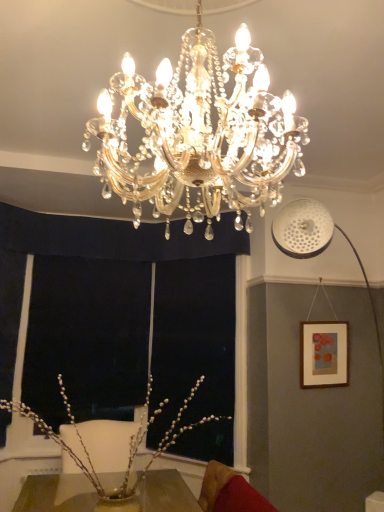
Measure the distance between velvet red swivel chair at lower right and camera.

velvet red swivel chair at lower right and camera are 7.40 feet apart from each other.

Where is `pearl-like branches at center`? pearl-like branches at center is located at coordinates (130, 444).

Find the location of a particular element. Image resolution: width=384 pixels, height=512 pixels. wooden picture frame at right is located at coordinates (323, 354).

Consider the image. Can you confirm if gold crystal chandelier at center is smaller than velvet red swivel chair at lower right?

No, gold crystal chandelier at center is not smaller than velvet red swivel chair at lower right.

Based on the photo, how much distance is there between gold crystal chandelier at center and velvet red swivel chair at lower right?

gold crystal chandelier at center and velvet red swivel chair at lower right are 1.90 meters apart.

From the image's perspective, does gold crystal chandelier at center appear higher than velvet red swivel chair at lower right?

Yes, from the image's perspective, gold crystal chandelier at center is on top of velvet red swivel chair at lower right.

From the picture: Are gold crystal chandelier at center and velvet red swivel chair at lower right located far from each other?

Yes, gold crystal chandelier at center and velvet red swivel chair at lower right are quite far apart.

In the scene shown: Which of these two, velvet red swivel chair at lower right or pearl-like branches at center, is smaller?

Smaller between the two is velvet red swivel chair at lower right.

Which object is closer to the camera taking this photo, velvet red swivel chair at lower right or pearl-like branches at center?

pearl-like branches at center is in front.

I want to click on floral arrangement above the velvet red swivel chair at lower right (from the image's perspective), so click(130, 444).

What's the angular difference between velvet red swivel chair at lower right and pearl-like branches at center's facing directions?

89 degrees separate the facing orientations of velvet red swivel chair at lower right and pearl-like branches at center.

Considering the relative positions of velvet red swivel chair at lower right and gold crystal chandelier at center in the image provided, is velvet red swivel chair at lower right behind gold crystal chandelier at center?

Yes.

Locate an element on the screen. This screenshot has width=384, height=512. lamp above the velvet red swivel chair at lower right (from a real-world perspective) is located at coordinates (199, 133).

Which object is thinner, velvet red swivel chair at lower right or gold crystal chandelier at center?

With smaller width is velvet red swivel chair at lower right.

Is point (302, 376) closer to viewer compared to point (249, 231)?

Yes, point (302, 376) is closer to viewer.

From the image's perspective, which is below, wooden picture frame at right or gold crystal chandelier at center?

wooden picture frame at right is shown below in the image.

Does wooden picture frame at right have a lesser width compared to gold crystal chandelier at center?

Correct, the width of wooden picture frame at right is less than that of gold crystal chandelier at center.

Is wooden picture frame at right not close to gold crystal chandelier at center?

Yes, wooden picture frame at right is far from gold crystal chandelier at center.

How many degrees apart are the facing directions of gold crystal chandelier at center and wooden picture frame at right?

90 degrees.

Looking at this image, from a real-world perspective, relative to wooden picture frame at right, is gold crystal chandelier at center vertically above or below?

Clearly, from a real-world perspective, gold crystal chandelier at center is above wooden picture frame at right.

Is gold crystal chandelier at center looking in the opposite direction of wooden picture frame at right?

That's not correct — gold crystal chandelier at center is not looking away from wooden picture frame at right.

From the image's perspective, is gold crystal chandelier at center beneath wooden picture frame at right?

No, from the image's perspective, gold crystal chandelier at center is not below wooden picture frame at right.

At what (x,y) coordinates should I click in order to perform the action: click on floral arrangement located underneath the gold crystal chandelier at center (from a real-world perspective). Please return your answer as a coordinate pair (x, y). Looking at the image, I should click on (130, 444).

From a real-world perspective, is gold crystal chandelier at center on top of pearl-like branches at center?

Yes, from a real-world perspective, gold crystal chandelier at center is over pearl-like branches at center

Considering the sizes of objects gold crystal chandelier at center and pearl-like branches at center in the image provided, who is smaller, gold crystal chandelier at center or pearl-like branches at center?

Smaller between the two is pearl-like branches at center.

From the picture: In terms of width, does pearl-like branches at center look wider or thinner when compared to wooden picture frame at right?

In the image, pearl-like branches at center appears to be wider than wooden picture frame at right.

Who is taller, pearl-like branches at center or wooden picture frame at right?

pearl-like branches at center is taller.

Can wooden picture frame at right be found inside pearl-like branches at center?

Definitely not — wooden picture frame at right is not inside pearl-like branches at center.

The width and height of the screenshot is (384, 512). In order to click on lamp on the left of velvet red swivel chair at lower right in this screenshot , I will do `click(199, 133)`.

This screenshot has width=384, height=512. Find the location of `floral arrangement above the velvet red swivel chair at lower right (from a real-world perspective)`. floral arrangement above the velvet red swivel chair at lower right (from a real-world perspective) is located at coordinates (130, 444).

Looking at the image, which one is located closer to velvet red swivel chair at lower right, gold crystal chandelier at center or wooden picture frame at right?

wooden picture frame at right is positioned closer to the anchor velvet red swivel chair at lower right.

When comparing their distances from gold crystal chandelier at center, does pearl-like branches at center or wooden picture frame at right seem further?

pearl-like branches at center is positioned further to the anchor gold crystal chandelier at center.

Which object lies nearer to the anchor point wooden picture frame at right, gold crystal chandelier at center or pearl-like branches at center?

The object closer to wooden picture frame at right is pearl-like branches at center.

Based on their spatial positions, is velvet red swivel chair at lower right or pearl-like branches at center closer to wooden picture frame at right?

Based on the image, pearl-like branches at center appears to be nearer to wooden picture frame at right.

Estimate the real-world distances between objects in this image. Which object is further from velvet red swivel chair at lower right, wooden picture frame at right or pearl-like branches at center?

Among the two, wooden picture frame at right is located further to velvet red swivel chair at lower right.

Based on their spatial positions, is pearl-like branches at center or velvet red swivel chair at lower right closer to wooden picture frame at right?

The object closer to wooden picture frame at right is pearl-like branches at center.

When comparing their distances from pearl-like branches at center, does wooden picture frame at right or gold crystal chandelier at center seem closer?

wooden picture frame at right.

When comparing their distances from velvet red swivel chair at lower right, does gold crystal chandelier at center or pearl-like branches at center seem further?

gold crystal chandelier at center lies further to velvet red swivel chair at lower right than the other object.

I want to click on floral arrangement that lies between gold crystal chandelier at center and velvet red swivel chair at lower right from top to bottom, so click(130, 444).

Where is `floral arrangement between gold crystal chandelier at center and wooden picture frame at right from front to back`? This screenshot has width=384, height=512. floral arrangement between gold crystal chandelier at center and wooden picture frame at right from front to back is located at coordinates (130, 444).

Locate an element on the screen. swivel chair positioned between pearl-like branches at center and wooden picture frame at right from near to far is located at coordinates (229, 492).

Locate an element on the screen. The image size is (384, 512). swivel chair between gold crystal chandelier at center and wooden picture frame at right along the z-axis is located at coordinates (229, 492).